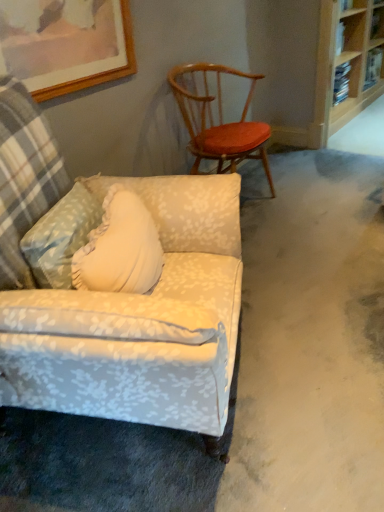
At what (x,y) coordinates should I click in order to perform the action: click on floral fabric armchair at lower left, which appears as the first chair when viewed from the front. Please return your answer as a coordinate pair (x, y). Looking at the image, I should click on (140, 321).

Describe the element at coordinates (218, 119) in the screenshot. I see `wooden spindles chair at upper right, which is counted as the 2th chair, starting from the front` at that location.

This screenshot has height=512, width=384. Identify the location of floral fabric armchair at lower left, which is the 2th chair in back-to-front order. (140, 321).

Looking at this image, considering the relative sizes of wooden bookshelf at upper right and wooden spindles chair at upper right, which appears as the first chair when viewed from the back, in the image provided, is wooden bookshelf at upper right taller than wooden spindles chair at upper right, which appears as the first chair when viewed from the back,?

Correct, wooden bookshelf at upper right is much taller as wooden spindles chair at upper right, which appears as the first chair when viewed from the back.

Is wooden bookshelf at upper right further to camera compared to wooden spindles chair at upper right, which appears as the first chair when viewed from the back?

Yes, wooden bookshelf at upper right is further from the viewer.

In the scene shown: Would you say wooden bookshelf at upper right is inside or outside wooden spindles chair at upper right, which is counted as the 2th chair, starting from the front?

wooden bookshelf at upper right is located beyond the bounds of wooden spindles chair at upper right, which is counted as the 2th chair, starting from the front.

Does point (326, 65) come farther from viewer compared to point (233, 142)?

Yes, it is behind point (233, 142).

Does point (195, 138) appear closer or farther from the camera than point (101, 2)?

Point (195, 138) is farther from the camera than point (101, 2).

Consider the image. Is wooden spindles chair at upper right, which is counted as the 2th chair, starting from the front, bigger or smaller than wooden picture frame at upper left?

Considering their sizes, wooden spindles chair at upper right, which is counted as the 2th chair, starting from the front, takes up more space than wooden picture frame at upper left.

From a real-world perspective, is wooden spindles chair at upper right, which appears as the first chair when viewed from the back, over wooden picture frame at upper left?

No.

From the image's perspective, is wooden spindles chair at upper right, which appears as the first chair when viewed from the back, positioned above or below wooden picture frame at upper left?

Based on their image positions, wooden spindles chair at upper right, which appears as the first chair when viewed from the back, is located beneath wooden picture frame at upper left.

Is wooden bookshelf at upper right at the left side of wooden picture frame at upper left?

No.

Is point (349, 113) behind point (82, 54)?

Yes, point (349, 113) is farther from viewer.

Does wooden bookshelf at upper right lie in front of wooden picture frame at upper left?

No, wooden bookshelf at upper right is behind wooden picture frame at upper left.

Is wooden bookshelf at upper right in contact with wooden picture frame at upper left?

wooden bookshelf at upper right and wooden picture frame at upper left are not in contact.

Identify the location of picture frame above the wooden spindles chair at upper right, which is counted as the 2th chair, starting from the front (from a real-world perspective). (65, 44).

Can we say wooden picture frame at upper left lies outside wooden spindles chair at upper right, which is counted as the 2th chair, starting from the front?

Absolutely, wooden picture frame at upper left is external to wooden spindles chair at upper right, which is counted as the 2th chair, starting from the front.

How distant is wooden picture frame at upper left from wooden spindles chair at upper right, which is counted as the 2th chair, starting from the front?

wooden picture frame at upper left is 25.84 inches from wooden spindles chair at upper right, which is counted as the 2th chair, starting from the front.

Considering their positions, is wooden picture frame at upper left located in front of or behind wooden spindles chair at upper right, which appears as the first chair when viewed from the back?

wooden picture frame at upper left is in front of wooden spindles chair at upper right, which appears as the first chair when viewed from the back.

Is wooden picture frame at upper left positioned far away from wooden bookshelf at upper right?

That's right, there is a large distance between wooden picture frame at upper left and wooden bookshelf at upper right.

In the image, is wooden picture frame at upper left on the left side or the right side of wooden bookshelf at upper right?

wooden picture frame at upper left is positioned on wooden bookshelf at upper right's left side.

Is wooden picture frame at upper left taller or shorter than wooden bookshelf at upper right?

wooden picture frame at upper left is shorter than wooden bookshelf at upper right.

Is wooden picture frame at upper left situated inside floral fabric armchair at lower left, which is the 2th chair in back-to-front order, or outside?

wooden picture frame at upper left cannot be found inside floral fabric armchair at lower left, which is the 2th chair in back-to-front order.

Can you confirm if wooden picture frame at upper left is taller than floral fabric armchair at lower left, which is the 2th chair in back-to-front order?

Incorrect, the height of wooden picture frame at upper left is not larger of that of floral fabric armchair at lower left, which is the 2th chair in back-to-front order.

From a real-world perspective, is wooden picture frame at upper left physically below floral fabric armchair at lower left, which is the 2th chair in back-to-front order?

No, from a real-world perspective, wooden picture frame at upper left is not below floral fabric armchair at lower left, which is the 2th chair in back-to-front order.

I want to click on shelf located above the wooden spindles chair at upper right, which is counted as the 2th chair, starting from the front (from a real-world perspective), so click(342, 63).

Measure the distance from wooden spindles chair at upper right, which is counted as the 2th chair, starting from the front, to wooden bookshelf at upper right.

wooden spindles chair at upper right, which is counted as the 2th chair, starting from the front, is 1.61 meters away from wooden bookshelf at upper right.

Considering their positions, is wooden spindles chair at upper right, which appears as the first chair when viewed from the back, located in front of or behind wooden bookshelf at upper right?

In the image, wooden spindles chair at upper right, which appears as the first chair when viewed from the back, appears in front of wooden bookshelf at upper right.

Between wooden spindles chair at upper right, which appears as the first chair when viewed from the back, and wooden bookshelf at upper right, which one has more height?

Standing taller between the two is wooden bookshelf at upper right.

You are a GUI agent. You are given a task and a screenshot of the screen. Output one action in this format:
    pyautogui.click(x=<x>, y=<y>)
    Task: Click on the shelf located behind the wooden spindles chair at upper right, which is counted as the 2th chair, starting from the front
    The width and height of the screenshot is (384, 512).
    Given the screenshot: What is the action you would take?
    pyautogui.click(x=342, y=63)

From the image's perspective, count 1st chairs downward from the wooden picture frame at upper left and point to it. Please provide its 2D coordinates.

[(218, 119)]

Looking at the image, which one is located closer to wooden spindles chair at upper right, which is counted as the 2th chair, starting from the front, wooden picture frame at upper left or floral fabric armchair at lower left, which is the 2th chair in back-to-front order?

Among the two, wooden picture frame at upper left is located nearer to wooden spindles chair at upper right, which is counted as the 2th chair, starting from the front.

From the picture: From the image, which object appears to be farther from floral fabric armchair at lower left, which appears as the first chair when viewed from the front, wooden bookshelf at upper right or wooden picture frame at upper left?

Based on the image, wooden bookshelf at upper right appears to be further to floral fabric armchair at lower left, which appears as the first chair when viewed from the front.

When comparing their distances from wooden picture frame at upper left, does floral fabric armchair at lower left, which appears as the first chair when viewed from the front, or wooden spindles chair at upper right, which appears as the first chair when viewed from the back, seem further?

Among the two, floral fabric armchair at lower left, which appears as the first chair when viewed from the front, is located further to wooden picture frame at upper left.

Estimate the real-world distances between objects in this image. Which object is further from wooden bookshelf at upper right, wooden picture frame at upper left or floral fabric armchair at lower left, which is the 2th chair in back-to-front order?

Among the two, floral fabric armchair at lower left, which is the 2th chair in back-to-front order, is located further to wooden bookshelf at upper right.

Based on their spatial positions, is wooden bookshelf at upper right or wooden picture frame at upper left closer to wooden spindles chair at upper right, which is counted as the 2th chair, starting from the front?

Among the two, wooden picture frame at upper left is located nearer to wooden spindles chair at upper right, which is counted as the 2th chair, starting from the front.

Looking at the image, which one is located further to wooden picture frame at upper left, wooden spindles chair at upper right, which is counted as the 2th chair, starting from the front, or floral fabric armchair at lower left, which appears as the first chair when viewed from the front?

floral fabric armchair at lower left, which appears as the first chair when viewed from the front.

Considering their positions, is wooden bookshelf at upper right positioned closer to wooden picture frame at upper left than floral fabric armchair at lower left, which appears as the first chair when viewed from the front?

Among the two, floral fabric armchair at lower left, which appears as the first chair when viewed from the front, is located nearer to wooden picture frame at upper left.

Looking at the image, which one is located closer to wooden bookshelf at upper right, wooden spindles chair at upper right, which appears as the first chair when viewed from the back, or floral fabric armchair at lower left, which is the 2th chair in back-to-front order?

wooden spindles chair at upper right, which appears as the first chair when viewed from the back.

Locate an element on the screen. Image resolution: width=384 pixels, height=512 pixels. picture frame between floral fabric armchair at lower left, which appears as the first chair when viewed from the front, and wooden spindles chair at upper right, which appears as the first chair when viewed from the back, along the z-axis is located at coordinates [65, 44].

This screenshot has width=384, height=512. Find the location of `chair located between floral fabric armchair at lower left, which appears as the first chair when viewed from the front, and wooden bookshelf at upper right in the depth direction`. chair located between floral fabric armchair at lower left, which appears as the first chair when viewed from the front, and wooden bookshelf at upper right in the depth direction is located at coordinates (218, 119).